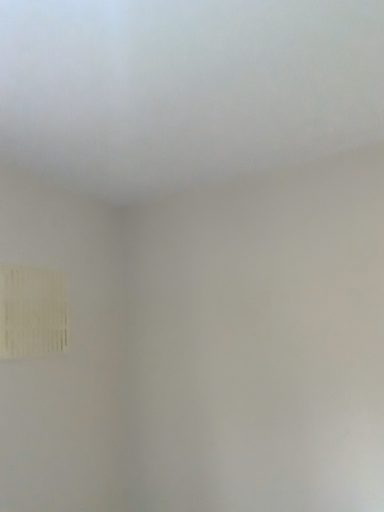
What do you see at coordinates (32, 312) in the screenshot? I see `white textured lampshade at lower left` at bounding box center [32, 312].

The image size is (384, 512). Find the location of `white textured lampshade at lower left`. white textured lampshade at lower left is located at coordinates (32, 312).

Find the location of a particular element. white textured lampshade at lower left is located at coordinates (x=32, y=312).